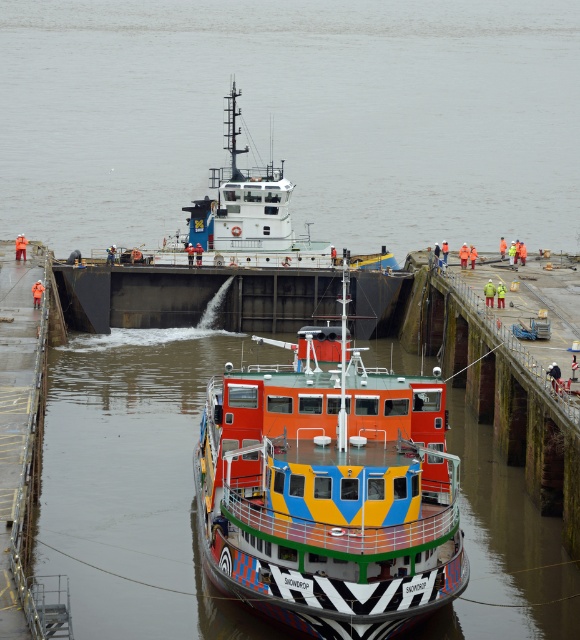
Consider the image. Between multicolored painted ship at center and white glossy tugboat at center, which one has more height?

white glossy tugboat at center

Can you confirm if multicolored painted ship at center is positioned to the right of white glossy tugboat at center?

Indeed, multicolored painted ship at center is positioned on the right side of white glossy tugboat at center.

The image size is (580, 640). What do you see at coordinates (328, 490) in the screenshot?
I see `multicolored painted ship at center` at bounding box center [328, 490].

At what (x,y) coordinates should I click in order to perform the action: click on multicolored painted ship at center. Please return your answer as a coordinate pair (x, y). Looking at the image, I should click on (328, 490).